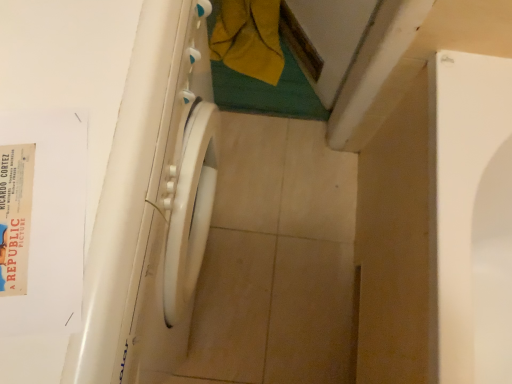
Identify the location of white plastic washing machine at left. (152, 201).

Describe the element at coordinates (152, 201) in the screenshot. This screenshot has width=512, height=384. I see `white plastic washing machine at left` at that location.

This screenshot has width=512, height=384. In order to click on white plastic washing machine at left in this screenshot , I will do (152, 201).